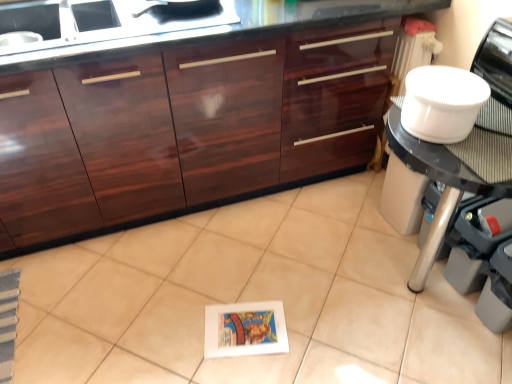
Image resolution: width=512 pixels, height=384 pixels. I want to click on white glossy tile at center, so click(252, 299).

Identify the location of glossy wood cabinetry at center. The width and height of the screenshot is (512, 384). (193, 117).

In the scene shown: Do you think white paper book at center is within white plastic bowl at upper right, or outside of it?

white paper book at center is not inside white plastic bowl at upper right, it's outside.

Locate an element on the screen. The image size is (512, 384). home appliance located above the white paper book at center (from the image's perspective) is located at coordinates (496, 76).

Which is nearer, (209, 346) or (508, 109)?

Point (508, 109)

How different are the orientations of white paper book at center and white plastic bowl at upper right in degrees?

The facing directions of white paper book at center and white plastic bowl at upper right are 13.3 degrees apart.

Based on their sizes in the image, would you say white paper book at center is bigger or smaller than white glossy tile at center?

Clearly, white paper book at center is smaller in size than white glossy tile at center.

From the image's perspective, is white paper book at center on white glossy tile at center?

No, from the image's perspective, white paper book at center is not above white glossy tile at center.

Between white paper book at center and white glossy tile at center, which one has less height?

white paper book at center is shorter.

Does point (209, 325) come behind point (443, 269)?

No, (209, 325) is closer to viewer.

Is white plastic bowl at right far away from white glossy tile at center?

white plastic bowl at right is near white glossy tile at center, not far away.

From a real-world perspective, who is located higher, white plastic bowl at right or white glossy tile at center?

white plastic bowl at right is physically above.

In the scene shown: From the image's perspective, does white plastic bowl at right appear lower than white glossy tile at center?

No, from the image's perspective, white plastic bowl at right is not beneath white glossy tile at center.

Is white plastic bowl at right facing towards white glossy tile at center?

No, white plastic bowl at right is not aimed at white glossy tile at center.

How distant is glossy wood cabinetry at center from white paper book at center?

glossy wood cabinetry at center is 30.18 inches from white paper book at center.

In the scene shown: Would you consider glossy wood cabinetry at center to be distant from white paper book at center?

No, glossy wood cabinetry at center is in close proximity to white paper book at center.

Could you tell me if glossy wood cabinetry at center is facing white paper book at center?

Yes, glossy wood cabinetry at center faces towards white paper book at center.

Could you tell me if white plastic bowl at right is facing glossy wood cabinetry at center?

No, white plastic bowl at right is not oriented towards glossy wood cabinetry at center.

Considering the relative positions of white plastic bowl at right and glossy wood cabinetry at center in the image provided, is white plastic bowl at right to the left of glossy wood cabinetry at center from the viewer's perspective?

No.

Considering the relative sizes of white plastic bowl at right and glossy wood cabinetry at center in the image provided, is white plastic bowl at right taller than glossy wood cabinetry at center?

Incorrect, the height of white plastic bowl at right is not larger of that of glossy wood cabinetry at center.

Consider the image. Is white plastic bowl at right situated inside glossy wood cabinetry at center or outside?

white plastic bowl at right exists outside the volume of glossy wood cabinetry at center.

Is glossy wood cabinetry at center oriented towards white glossy tile at center?

Yes, glossy wood cabinetry at center is oriented towards white glossy tile at center.

From the image's perspective, is glossy wood cabinetry at center located above or below white glossy tile at center?

glossy wood cabinetry at center is situated higher than white glossy tile at center in the image.

Who is smaller, glossy wood cabinetry at center or white glossy tile at center?

Smaller between the two is white glossy tile at center.

This screenshot has height=384, width=512. What are the coordinates of `appliance lying in front of the white plastic bowl at upper right` in the screenshot? It's located at (442, 103).

From a real-world perspective, is white plastic bowl at right physically below white plastic bowl at upper right?

Correct, in the physical world, white plastic bowl at right is lower than white plastic bowl at upper right.

Between white plastic bowl at right and white plastic bowl at upper right, which one has smaller size?

Smaller between the two is white plastic bowl at right.

Is white plastic bowl at upper right located within white plastic bowl at right?

Actually, white plastic bowl at upper right is outside white plastic bowl at right.

There is a white paper book at center. Identify the location of home appliance above it (from a real-world perspective). (496, 76).

The height and width of the screenshot is (384, 512). I want to click on ceramic tile below the white paper book at center (from a real-world perspective), so click(252, 299).

Considering their positions, is white paper book at center positioned further to glossy wood cabinetry at center than white plastic bowl at right?

white plastic bowl at right is positioned further to the anchor glossy wood cabinetry at center.

From the image, which object appears to be nearer to white paper book at center, white plastic bowl at right or glossy wood cabinetry at center?

glossy wood cabinetry at center lies closer to white paper book at center than the other object.

Estimate the real-world distances between objects in this image. Which object is further from glossy wood cabinetry at center, white glossy tile at center or white paper book at center?

The object further to glossy wood cabinetry at center is white paper book at center.

When comparing their distances from glossy wood cabinetry at center, does white paper book at center or white plastic bowl at upper right seem closer?

white paper book at center lies closer to glossy wood cabinetry at center than the other object.

Considering their positions, is white glossy tile at center positioned closer to white paper book at center than glossy wood cabinetry at center?

white glossy tile at center is positioned closer to the anchor white paper book at center.

Which object lies further to the anchor point white glossy tile at center, white paper book at center or white plastic bowl at right?

white plastic bowl at right.

Based on their spatial positions, is white glossy tile at center or glossy wood cabinetry at center closer to white plastic bowl at upper right?

Based on the image, glossy wood cabinetry at center appears to be nearer to white plastic bowl at upper right.

From the image, which object appears to be farther from glossy wood cabinetry at center, white glossy tile at center or white plastic bowl at upper right?

Based on the image, white plastic bowl at upper right appears to be further to glossy wood cabinetry at center.

Image resolution: width=512 pixels, height=384 pixels. In order to click on ceramic tile located between glossy wood cabinetry at center and white plastic bowl at upper right in the left-right direction in this screenshot , I will do `click(252, 299)`.

Locate an element on the screen. This screenshot has height=384, width=512. appliance between glossy wood cabinetry at center and white plastic bowl at upper right from left to right is located at coordinates (442, 103).

This screenshot has height=384, width=512. What are the coordinates of `ceramic tile between glossy wood cabinetry at center and white paper book at center from top to bottom` in the screenshot? It's located at (252, 299).

Locate an element on the screen. ceramic tile between glossy wood cabinetry at center and white plastic bowl at right is located at coordinates [x=252, y=299].